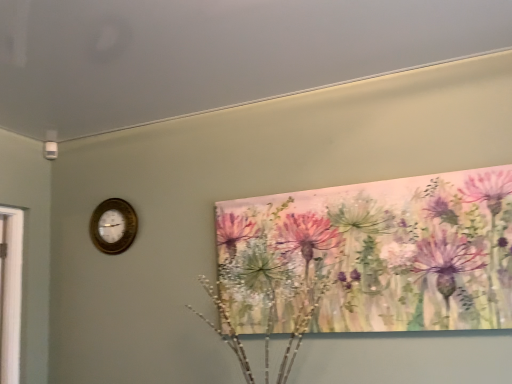
Question: Can you confirm if gold metallic wall clock at left is smaller than watercolor flowers at upper right?

Choices:
 (A) no
 (B) yes

Answer: (B)

Question: Is gold metallic wall clock at left outside watercolor flowers at upper right?

Choices:
 (A) no
 (B) yes

Answer: (B)

Question: Does gold metallic wall clock at left come in front of watercolor flowers at upper right?

Choices:
 (A) yes
 (B) no

Answer: (B)

Question: From the image's perspective, is gold metallic wall clock at left on watercolor flowers at upper right?

Choices:
 (A) no
 (B) yes

Answer: (B)

Question: From the image's perspective, does gold metallic wall clock at left appear lower than watercolor flowers at upper right?

Choices:
 (A) yes
 (B) no

Answer: (B)

Question: Is gold metallic wall clock at left facing towards watercolor flowers at upper right?

Choices:
 (A) no
 (B) yes

Answer: (A)

Question: From the image's perspective, is watercolor flowers at upper right above gold metallic wall clock at left?

Choices:
 (A) no
 (B) yes

Answer: (A)

Question: Does watercolor flowers at upper right appear on the right side of gold metallic wall clock at left?

Choices:
 (A) yes
 (B) no

Answer: (A)

Question: Considering the relative sizes of watercolor flowers at upper right and gold metallic wall clock at left in the image provided, is watercolor flowers at upper right thinner than gold metallic wall clock at left?

Choices:
 (A) yes
 (B) no

Answer: (B)

Question: Is the depth of watercolor flowers at upper right greater than that of gold metallic wall clock at left?

Choices:
 (A) yes
 (B) no

Answer: (B)

Question: Is watercolor flowers at upper right located outside gold metallic wall clock at left?

Choices:
 (A) no
 (B) yes

Answer: (B)

Question: Considering the relative sizes of watercolor flowers at upper right and gold metallic wall clock at left in the image provided, is watercolor flowers at upper right bigger than gold metallic wall clock at left?

Choices:
 (A) yes
 (B) no

Answer: (A)

Question: Considering the positions of watercolor flowers at upper right and gold metallic wall clock at left in the image, is watercolor flowers at upper right wider or thinner than gold metallic wall clock at left?

Choices:
 (A) thin
 (B) wide

Answer: (B)